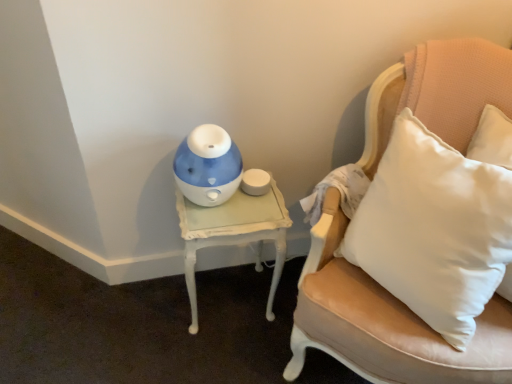
In order to click on free space to the left of white painted wood table at left in this screenshot , I will do pyautogui.click(x=141, y=314).